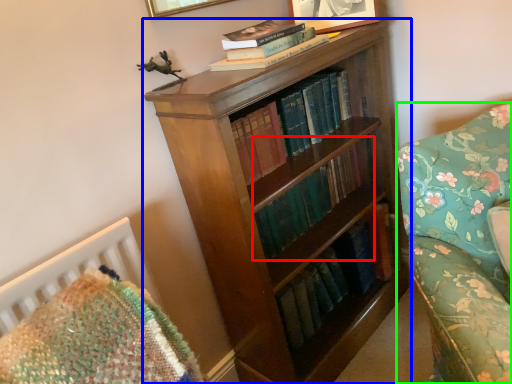
Question: Which object is positioned farthest from book (highlighted by a red box)? Select from bookcase (highlighted by a blue box) and studio couch (highlighted by a green box).

Choices:
 (A) bookcase
 (B) studio couch

Answer: (B)